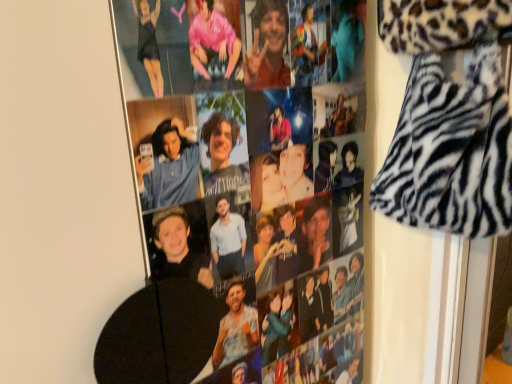
You are a GUI agent. You are given a task and a screenshot of the screen. Output one action in this format:
    pyautogui.click(x=<x>, y=<y>)
    Task: Click on the printed photo collage at center
    The width and height of the screenshot is (512, 384).
    Given the screenshot: What is the action you would take?
    pyautogui.click(x=239, y=199)

Describe the element at coordinates (239, 199) in the screenshot. Image resolution: width=512 pixels, height=384 pixels. I see `printed photo collage at center` at that location.

I want to click on printed photo collage at center, so click(x=239, y=199).